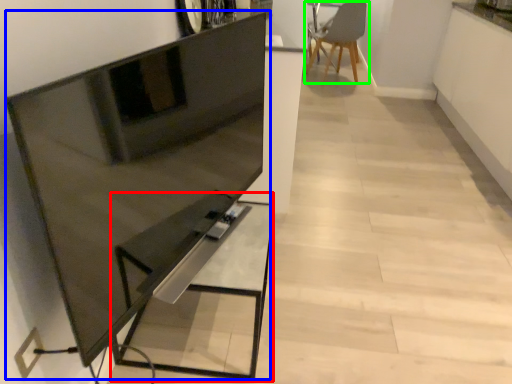
Question: Based on their relative distances, which object is nearer to table (highlighted by a red box)? Choose from entertainment center (highlighted by a blue box) and chair (highlighted by a green box).

Choices:
 (A) entertainment center
 (B) chair

Answer: (A)